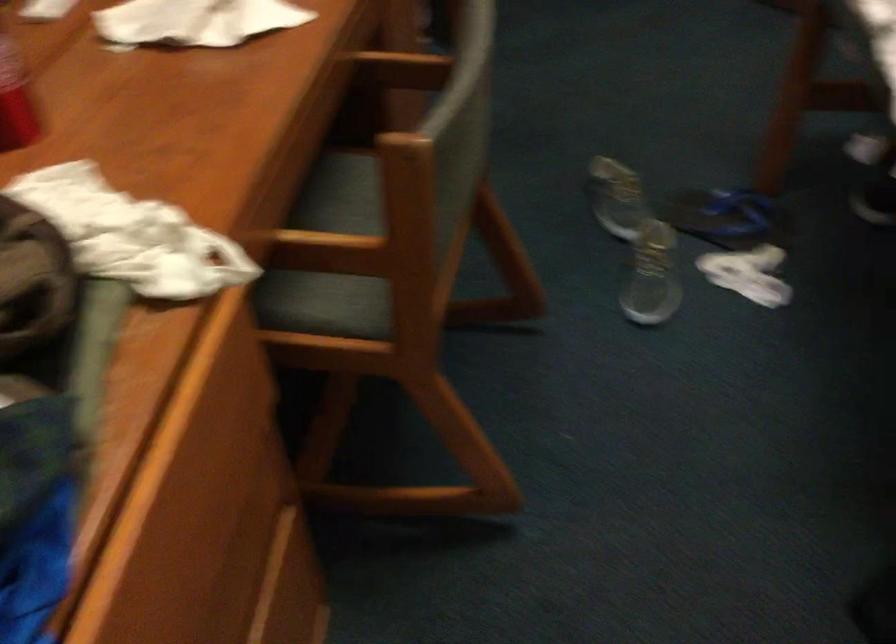
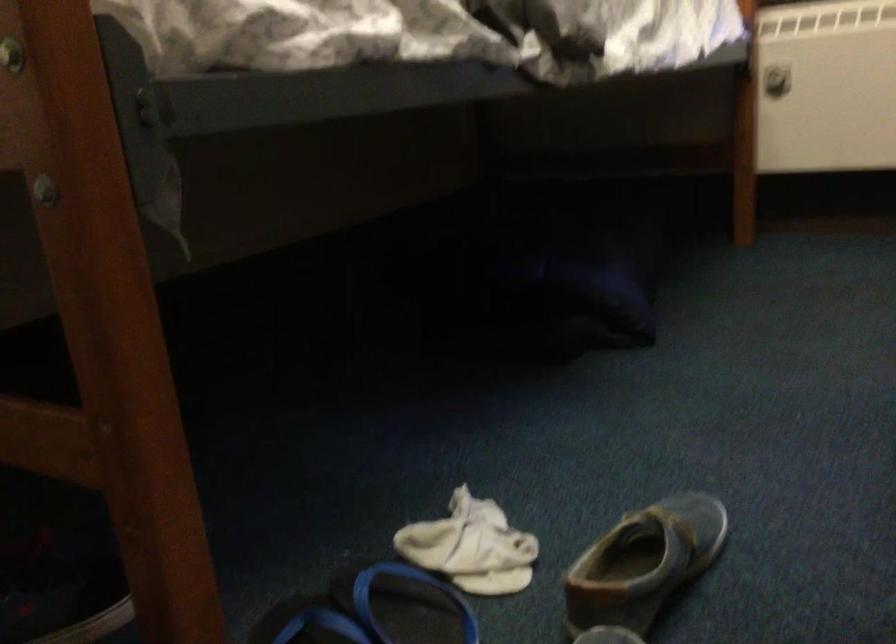
The point at (x=736, y=234) is marked in the first image. Where is the corresponding point in the second image?

(406, 605)